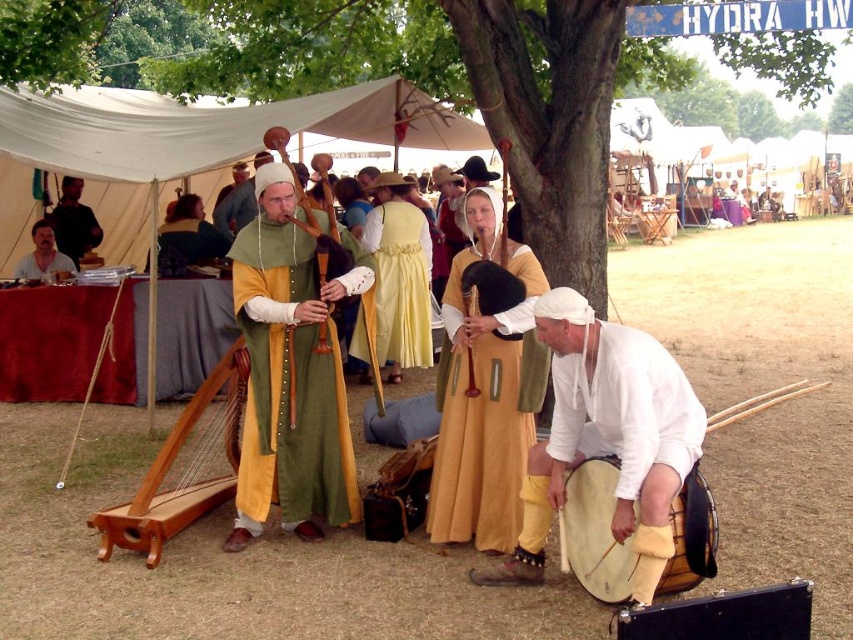
This screenshot has height=640, width=853. What do you see at coordinates (207, 132) in the screenshot? I see `white canvas tent at center` at bounding box center [207, 132].

Who is shorter, white canvas tent at center or yellow satin dress at center?

Standing shorter between the two is white canvas tent at center.

Identify the location of white canvas tent at center. The height and width of the screenshot is (640, 853). (207, 132).

Locate an element on the screen. This screenshot has height=640, width=853. white canvas tent at center is located at coordinates (207, 132).

Which is more to the left, white matte drum at lower right or matte black shirt at left?

From the viewer's perspective, matte black shirt at left appears more on the left side.

Looking at this image, who is more forward, (614, 538) or (32, 273)?

Positioned in front is point (614, 538).

Where is `white matte drum at lower right`? The image size is (853, 640). white matte drum at lower right is located at coordinates (606, 438).

Is point (640, 568) positioned after point (688, 536)?

Yes, it is.

Between point (619, 493) and point (570, 509), which one is positioned behind?

Positioned behind is point (570, 509).

Is point (607, 428) less distant than point (709, 499)?

That is False.

Where is `white matte drum at lower right`? Image resolution: width=853 pixels, height=640 pixels. white matte drum at lower right is located at coordinates (606, 438).